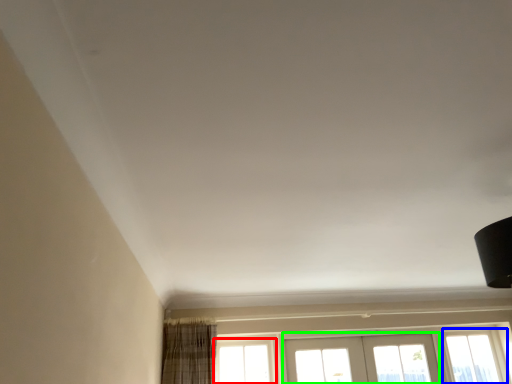
Question: Estimate the real-world distances between objects in this image. Which object is farther from window (highlighted by a red box), window (highlighted by a blue box) or screen door (highlighted by a green box)?

Choices:
 (A) window
 (B) screen door

Answer: (A)